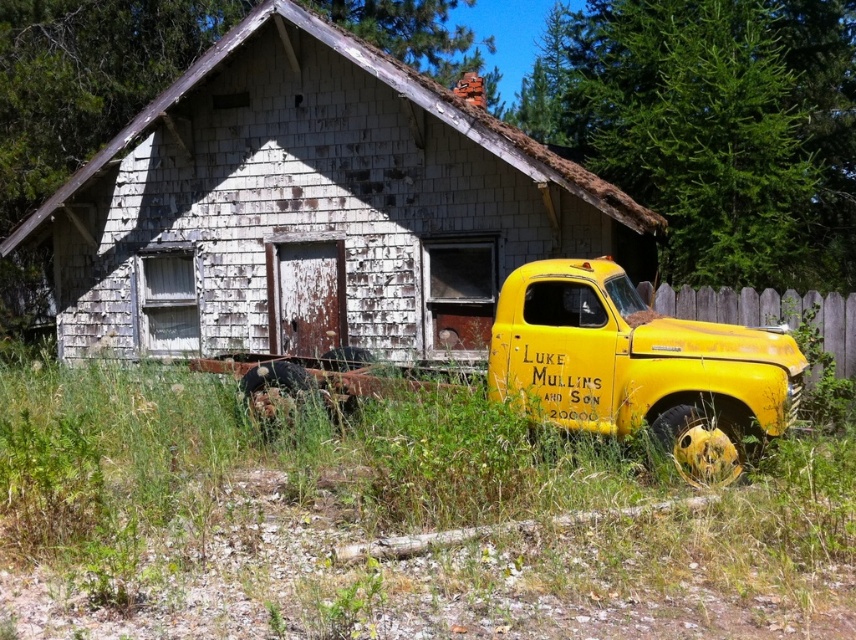
Does point (67, 372) lie behind point (622, 364)?

Yes, it is.

Is point (43, 472) positioned before point (681, 419)?

Yes.

Which is in front, point (578, 614) or point (490, 356)?

Point (578, 614)

What are the coordinates of `green grass at lower center` in the screenshot? It's located at (x=388, y=522).